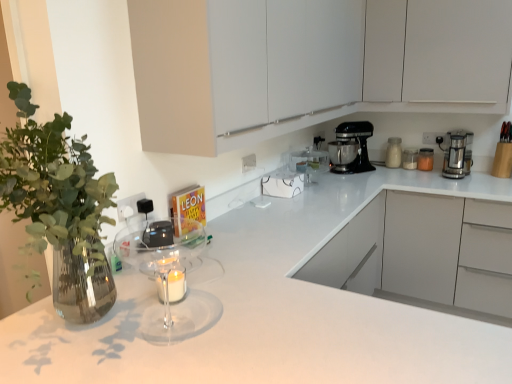
Question: From a real-world perspective, is black metallic stand mixer at upper right, the 1th kitchen appliance when ordered from left to right, physically located above or below translucent glass jar at upper right, the second kitchen appliance in the right-to-left sequence?

Choices:
 (A) above
 (B) below

Answer: (A)

Question: From the image's perspective, is black metallic stand mixer at upper right, positioned as the fourth kitchen appliance in right-to-left order, located above or below translucent glass jar at upper right, the second kitchen appliance in the right-to-left sequence?

Choices:
 (A) below
 (B) above

Answer: (B)

Question: Considering the real-world distances, which object is closest to the white glossy countertop at center?

Choices:
 (A) black metallic stand mixer at upper right, the 1th kitchen appliance when ordered from left to right
 (B) translucent glass jar at upper right, the second kitchen appliance in the right-to-left sequence
 (C) white matte cabinet at upper center, arranged as the 1th cabinetry when viewed from the back
 (D) white matte cabinet at upper center, the second cabinetry when ordered from back to front
 (E) transparent glass mixer at center

Answer: (E)

Question: Which object is the closest to the translucent glass jar at upper right, acting as the 3th kitchen appliance starting from the left?

Choices:
 (A) white glossy jar at upper right, which is the 2th kitchen appliance from left to right
 (B) transparent glass mixer at center
 (C) black metallic stand mixer at upper right, the 1th kitchen appliance when ordered from left to right
 (D) white matte cabinet at upper center, arranged as the 1th cabinetry when viewed from the back
 (E) white glossy countertop at center

Answer: (A)